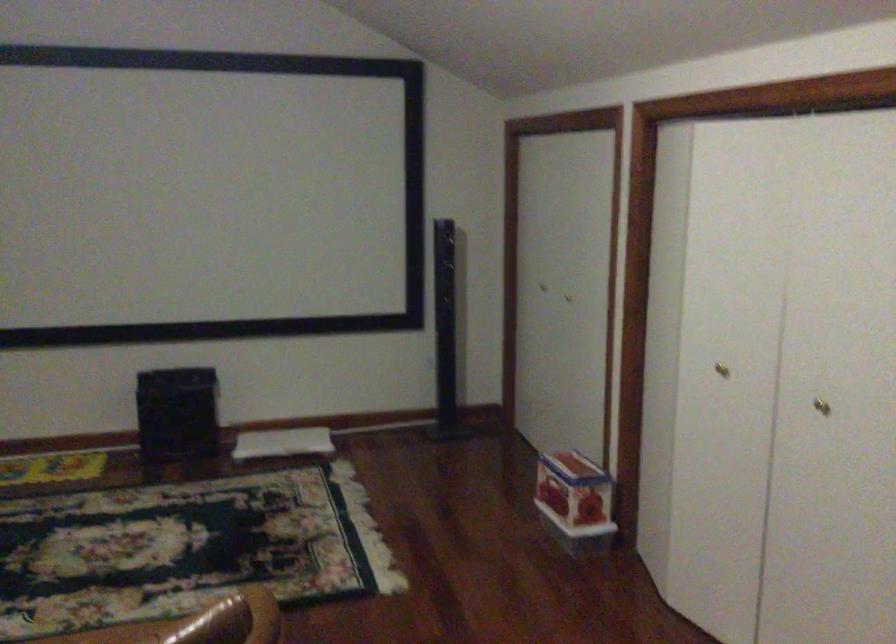
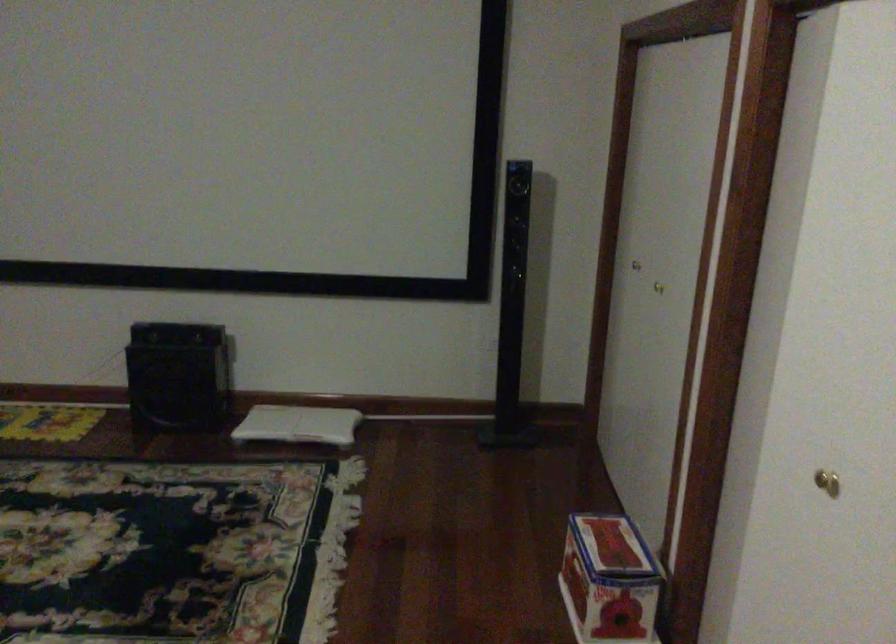
The images are taken continuously from a first-person perspective. In which direction are you moving?

The cameraman moved toward right, forward.